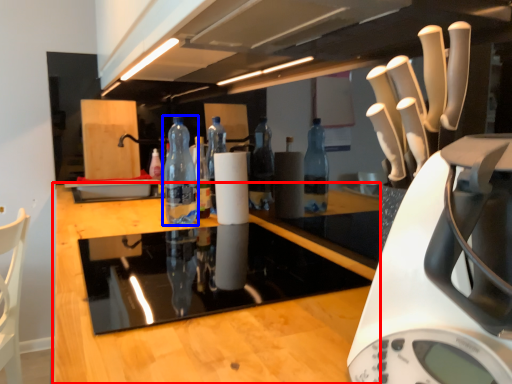
Question: Which of the following is the farthest to the observer, countertop (highlighted by a red box) or bottle (highlighted by a blue box)?

Choices:
 (A) countertop
 (B) bottle

Answer: (B)